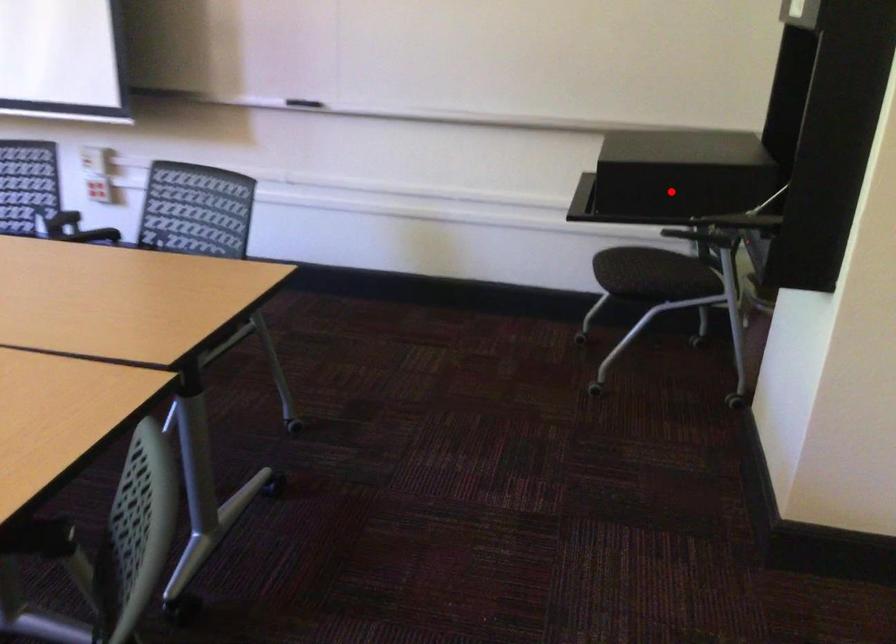
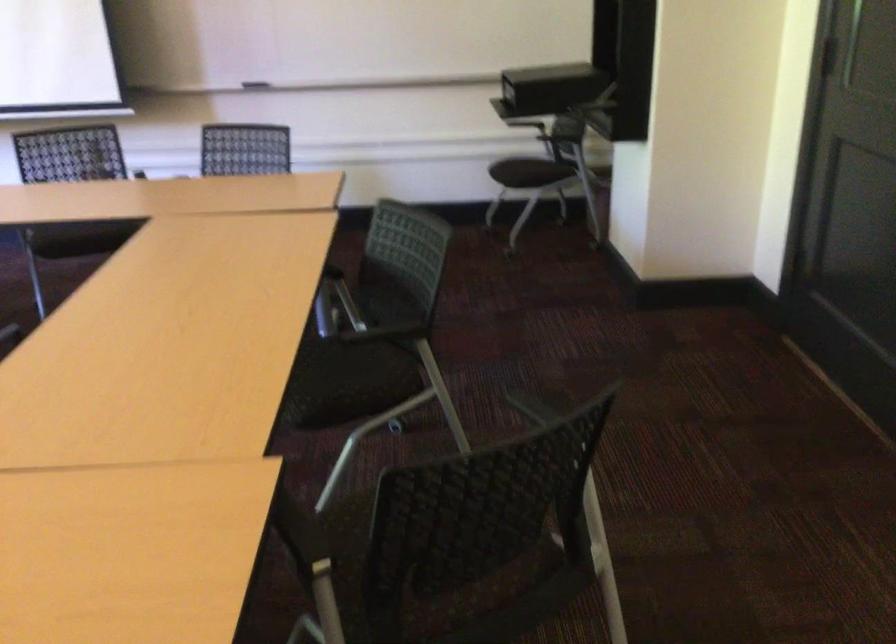
Where in the second image is the point corresponding to the highlighted location from the first image?

(549, 88)